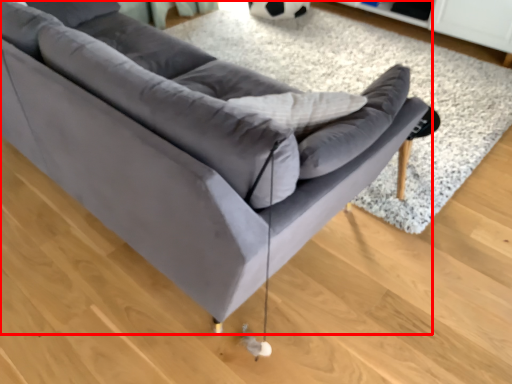
Question: Considering the relative positions of studio couch (annotated by the red box) and mat in the image provided, where is studio couch (annotated by the red box) located with respect to the staircase?

Choices:
 (A) right
 (B) left

Answer: (B)